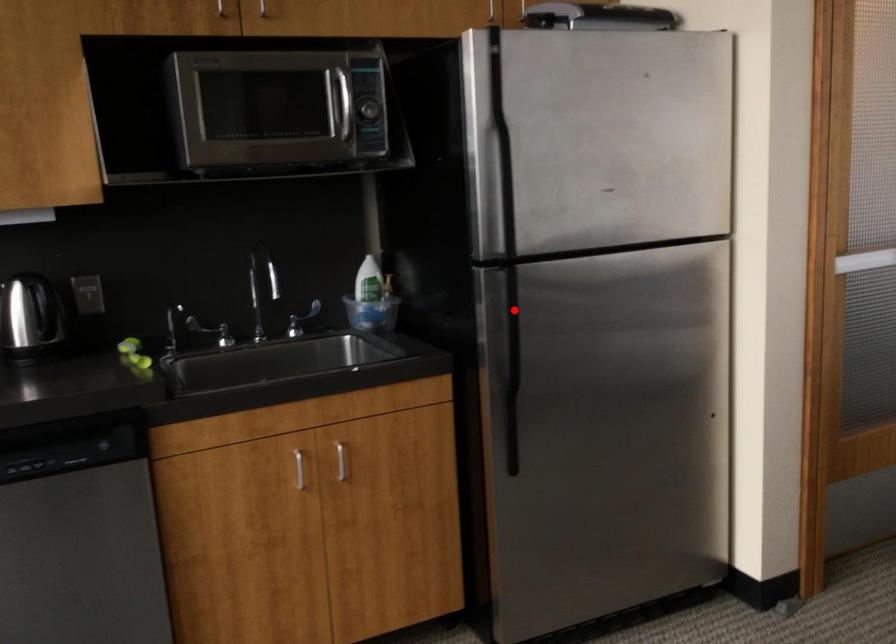
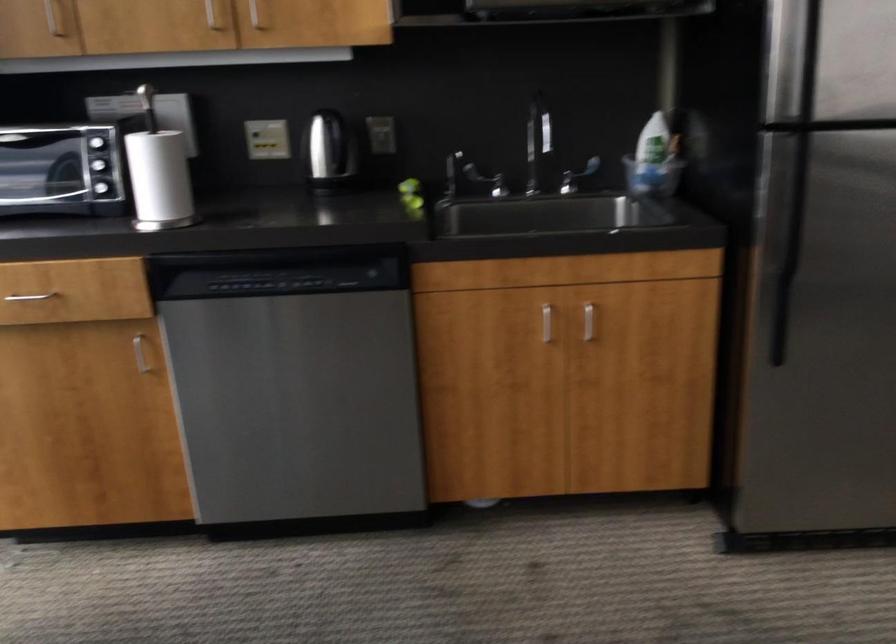
Find the pixel in the second image that matches the highlighted location in the first image.

(797, 181)